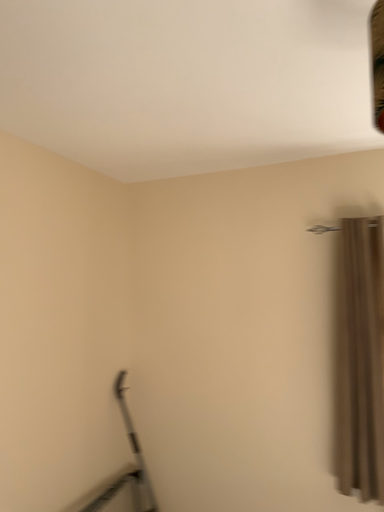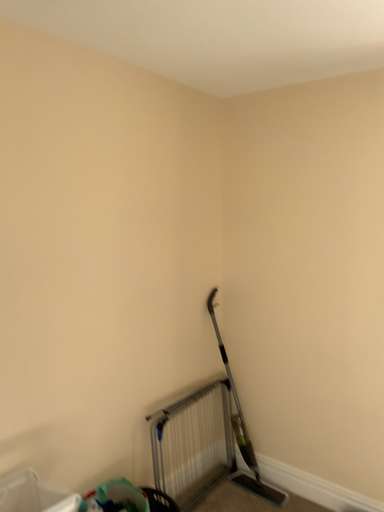
Question: How did the camera likely rotate when shooting the video?

Choices:
 (A) rotated left
 (B) rotated right

Answer: (A)